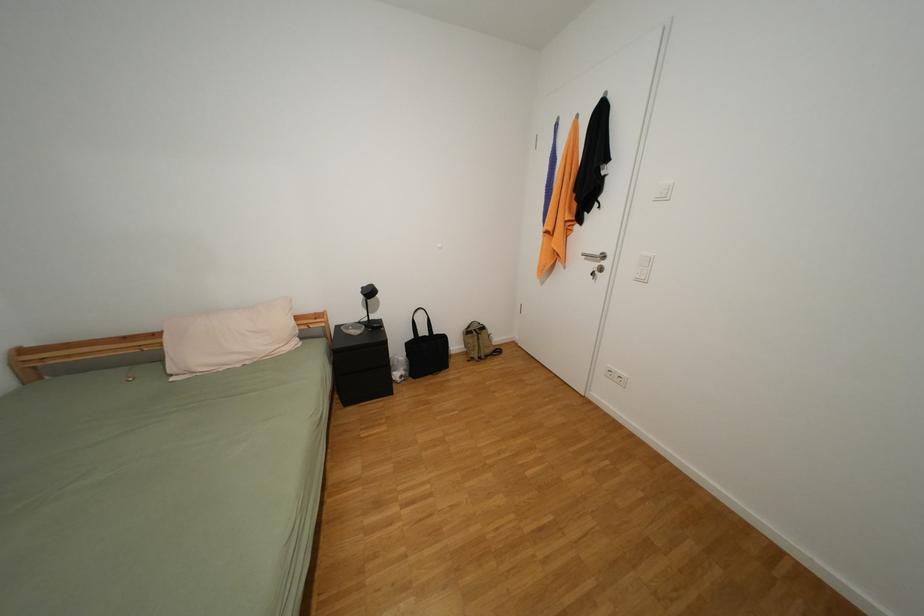
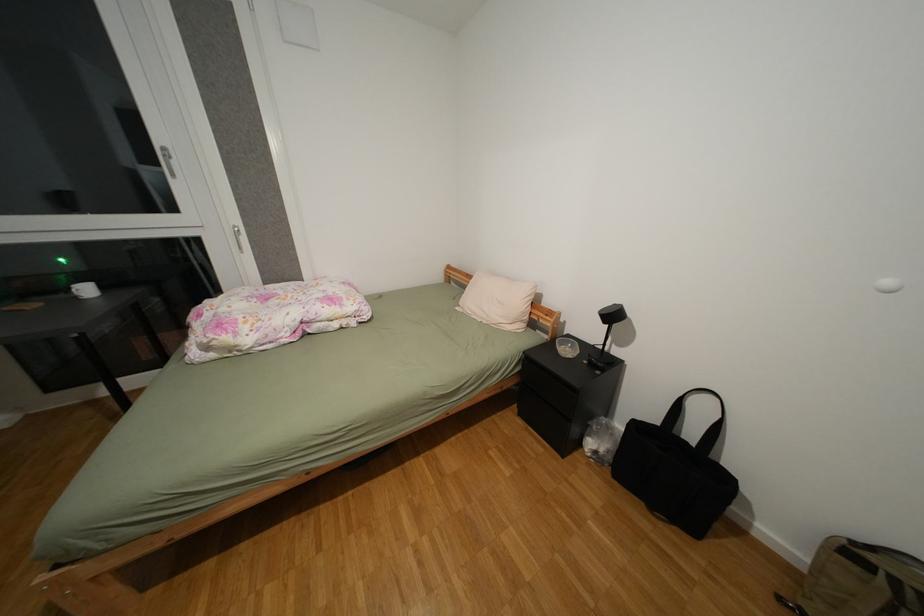
How did the camera likely rotate?

The camera's rotation is toward left-down.